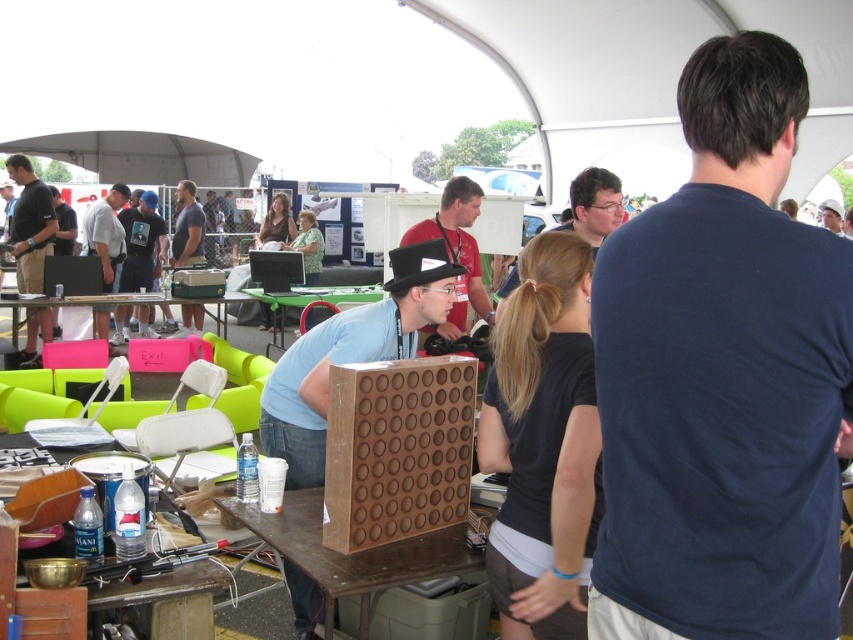
You are attending an outdoor fair and see the wooden game board at center and the matte black shirt at center. Which object is positioned lower in the image?

The wooden game board at center is positioned lower than the matte black shirt at center in the image.